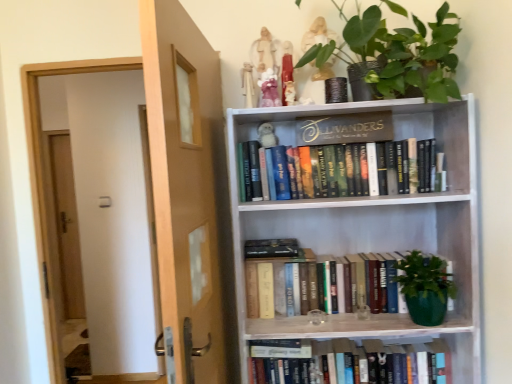
Image resolution: width=512 pixels, height=384 pixels. Find the location of `white wood bookcase at upper right`. white wood bookcase at upper right is located at coordinates (370, 227).

This screenshot has width=512, height=384. Identify the location of white porcelain owl at upper center, the second toy in the right-to-left sequence. (289, 93).

Measure the distance between point (252, 107) and camera.

Point (252, 107) is 5.15 feet from camera.

Where is `pink fabric doll at upper center, marked as the 3th toy in a left-to-right arrangement`? pink fabric doll at upper center, marked as the 3th toy in a left-to-right arrangement is located at coordinates (269, 89).

Image resolution: width=512 pixels, height=384 pixels. What are the coordinates of `white wood bookcase at upper right` in the screenshot? It's located at (370, 227).

Is gold metallic sign at upper center oriented away from white fabric doll at upper center, which is the 5th toy in right-to-left order?

gold metallic sign at upper center is not turned away from white fabric doll at upper center, which is the 5th toy in right-to-left order.

Does gold metallic sign at upper center have a greater height compared to white fabric doll at upper center, which is the 5th toy in right-to-left order?

No, gold metallic sign at upper center is not taller than white fabric doll at upper center, which is the 5th toy in right-to-left order.

How distant is gold metallic sign at upper center from white fabric doll at upper center, which is the 1th toy from left to right?

They are 13.07 inches apart.

Is white fabric doll at upper center, which is the 1th toy from left to right, completely or partially inside gold metallic sign at upper center?

No.

Is matte white figurine at upper center, marked as the fifth toy in a left-to-right arrangement, to the left of brown wooden door at left from the viewer's perspective?

In fact, matte white figurine at upper center, marked as the fifth toy in a left-to-right arrangement, is to the right of brown wooden door at left.

Do you think matte white figurine at upper center, which is the first toy in right-to-left order, is within brown wooden door at left, or outside of it?

matte white figurine at upper center, which is the first toy in right-to-left order, is outside brown wooden door at left.

Relative to brown wooden door at left, is matte white figurine at upper center, marked as the fifth toy in a left-to-right arrangement, in front or behind?

In the image, matte white figurine at upper center, marked as the fifth toy in a left-to-right arrangement, appears behind brown wooden door at left.

Is point (332, 75) in front of point (173, 311)?

That is False.

Starting from the matte white figurine at upper center, which is the first toy in right-to-left order, which book is the 1st one to the right? Please provide its 2D coordinates.

[(354, 167)]

From a real-world perspective, relative to matte white figurine at upper center, which is the first toy in right-to-left order, is hardcover books at center, marked as the 1th book in a top-to-bottom arrangement, vertically above or below?

hardcover books at center, marked as the 1th book in a top-to-bottom arrangement, is situated lower than matte white figurine at upper center, which is the first toy in right-to-left order, in the real world.

Would you say hardcover books at center, marked as the 1th book in a top-to-bottom arrangement, is a long distance from matte white figurine at upper center, marked as the fifth toy in a left-to-right arrangement?

hardcover books at center, marked as the 1th book in a top-to-bottom arrangement, is actually quite close to matte white figurine at upper center, marked as the fifth toy in a left-to-right arrangement.

Which is more to the right, hardcover books at center, the third book positioned from the bottom, or matte white figurine at upper center, marked as the fifth toy in a left-to-right arrangement?

Positioned to the right is hardcover books at center, the third book positioned from the bottom.

Looking at this image, measure the distance between pink fabric doll at upper center, the 3th toy in the right-to-left sequence, and white wood bookcase at upper right.

They are 24.08 inches apart.

In terms of width, does pink fabric doll at upper center, marked as the 3th toy in a left-to-right arrangement, look wider or thinner when compared to white wood bookcase at upper right?

In the image, pink fabric doll at upper center, marked as the 3th toy in a left-to-right arrangement, appears to be more narrow than white wood bookcase at upper right.

From the image's perspective, which object appears higher, pink fabric doll at upper center, the 3th toy in the right-to-left sequence, or white wood bookcase at upper right?

pink fabric doll at upper center, the 3th toy in the right-to-left sequence, is shown above in the image.

In the image, is pink fabric doll at upper center, marked as the 3th toy in a left-to-right arrangement, positioned in front of or behind white wood bookcase at upper right?

pink fabric doll at upper center, marked as the 3th toy in a left-to-right arrangement, is positioned farther from the viewer than white wood bookcase at upper right.

Is white plush monkey at upper center, which is the 4th toy in right-to-left order, further to camera compared to hardcover books at center, marked as the 1th book in a top-to-bottom arrangement?

Yes, white plush monkey at upper center, which is the 4th toy in right-to-left order, is behind hardcover books at center, marked as the 1th book in a top-to-bottom arrangement.

Which of these two, white plush monkey at upper center, which appears as the 2th toy when viewed from the left, or hardcover books at center, the third book positioned from the bottom, stands shorter?

With less height is white plush monkey at upper center, which appears as the 2th toy when viewed from the left.

There is a white plush monkey at upper center, which appears as the 2th toy when viewed from the left. In order to click on the 1st book below it (from a real-world perspective) in this screenshot , I will do `click(354, 167)`.

Considering the sizes of green matte plant at upper center and white wood bookcase at upper right in the image, is green matte plant at upper center bigger or smaller than white wood bookcase at upper right?

Considering their sizes, green matte plant at upper center takes up less space than white wood bookcase at upper right.

From a real-world perspective, between green matte plant at upper center and white wood bookcase at upper right, who is vertically lower?

white wood bookcase at upper right is physically lower.

How many degrees apart are the facing directions of green matte plant at upper center and white wood bookcase at upper right?

The angle between the facing direction of green matte plant at upper center and the facing direction of white wood bookcase at upper right is 0.000456 degrees.

From the image's perspective, which is below, white porcelain owl at upper center, the second toy in the right-to-left sequence, or hardcover book at lower center, the first book from the bottom?

From the image's view, hardcover book at lower center, the first book from the bottom, is below.

Is white porcelain owl at upper center, the second toy in the right-to-left sequence, thinner than hardcover book at lower center, the 3th book in the top-to-bottom sequence?

Yes, white porcelain owl at upper center, the second toy in the right-to-left sequence, is thinner than hardcover book at lower center, the 3th book in the top-to-bottom sequence.

At what (x,y) coordinates should I click in order to perform the action: click on paperback book located on the right of white fabric doll at upper center, which is the 1th toy from left to right. Please return your answer as a coordinate pair (x, y). Looking at the image, I should click on (344, 128).

Find the location of a particular element. toy that is the 5th one when counting upward from the brown wooden door at left (from the image's perspective) is located at coordinates (317, 34).

From the image, which object appears to be farther from hardcover books at center, acting as the second book starting from the top, green matte plant at upper center or matte white figurine at upper center, which is the first toy in right-to-left order?

matte white figurine at upper center, which is the first toy in right-to-left order, lies further to hardcover books at center, acting as the second book starting from the top, than the other object.

When comparing their distances from white plush monkey at upper center, which is the 4th toy in right-to-left order, does white fabric doll at upper center, which is the 5th toy in right-to-left order, or brown wooden door at left seem further?

brown wooden door at left is positioned further to the anchor white plush monkey at upper center, which is the 4th toy in right-to-left order.

Based on their spatial positions, is green matte plant at upper center or white wood bookcase at upper right further from hardcover books at center, marked as the 1th book in a top-to-bottom arrangement?

green matte plant at upper center.

From the image, which object appears to be nearer to hardcover book at lower center, the first book from the bottom, white porcelain owl at upper center, the second toy in the right-to-left sequence, or white fabric doll at upper center, which is the 5th toy in right-to-left order?

white porcelain owl at upper center, the second toy in the right-to-left sequence, is positioned closer to the anchor hardcover book at lower center, the first book from the bottom.

From the image, which object appears to be farther from green matte plant at upper center, white fabric doll at upper center, which is the 5th toy in right-to-left order, or gold metallic sign at upper center?

white fabric doll at upper center, which is the 5th toy in right-to-left order, is positioned further to the anchor green matte plant at upper center.

Based on their spatial positions, is white porcelain owl at upper center, the second toy in the right-to-left sequence, or hardcover book at lower center, the 3th book in the top-to-bottom sequence, further from pink fabric doll at upper center, the 3th toy in the right-to-left sequence?

hardcover book at lower center, the 3th book in the top-to-bottom sequence, is positioned further to the anchor pink fabric doll at upper center, the 3th toy in the right-to-left sequence.

Looking at this image, which object lies further to the anchor point hardcover books at center, the third book positioned from the bottom, white wood bookcase at upper right or white plush monkey at upper center, which appears as the 2th toy when viewed from the left?

white plush monkey at upper center, which appears as the 2th toy when viewed from the left, lies further to hardcover books at center, the third book positioned from the bottom, than the other object.

Which object lies further to the anchor point white wood bookcase at upper right, hardcover book at lower center, the 3th book in the top-to-bottom sequence, or hardcover books at center, the third book positioned from the bottom?

Based on the image, hardcover book at lower center, the 3th book in the top-to-bottom sequence, appears to be further to white wood bookcase at upper right.

Identify the location of paperback book between matte white figurine at upper center, which is the first toy in right-to-left order, and hardcover books at center, the third book positioned from the bottom, from top to bottom. (344, 128).

Locate an element on the screen. This screenshot has height=384, width=512. book between pink fabric doll at upper center, marked as the 3th toy in a left-to-right arrangement, and hardcover books at center, the second book ordered from the bottom, in the vertical direction is located at coordinates point(354,167).

This screenshot has height=384, width=512. I want to click on bookcase between brown wooden door at left and gold metallic sign at upper center in the front-back direction, so click(x=370, y=227).

This screenshot has height=384, width=512. Find the location of `book between white fabric doll at upper center, which is the 5th toy in right-to-left order, and hardcover books at center, acting as the second book starting from the top, in the up-down direction`. book between white fabric doll at upper center, which is the 5th toy in right-to-left order, and hardcover books at center, acting as the second book starting from the top, in the up-down direction is located at coordinates (354, 167).